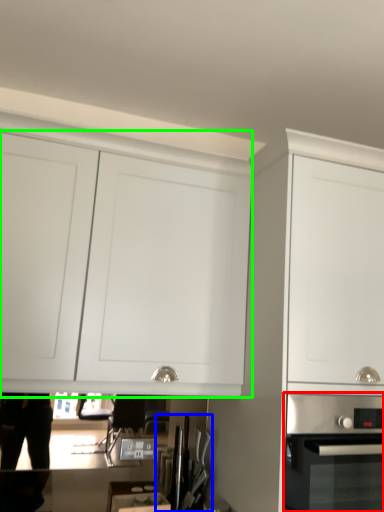
Question: Which object is positioned closest to home appliance (highlighted by a red box)? Select from kitchen appliance (highlighted by a blue box) and cabinetry (highlighted by a green box).

Choices:
 (A) kitchen appliance
 (B) cabinetry

Answer: (A)